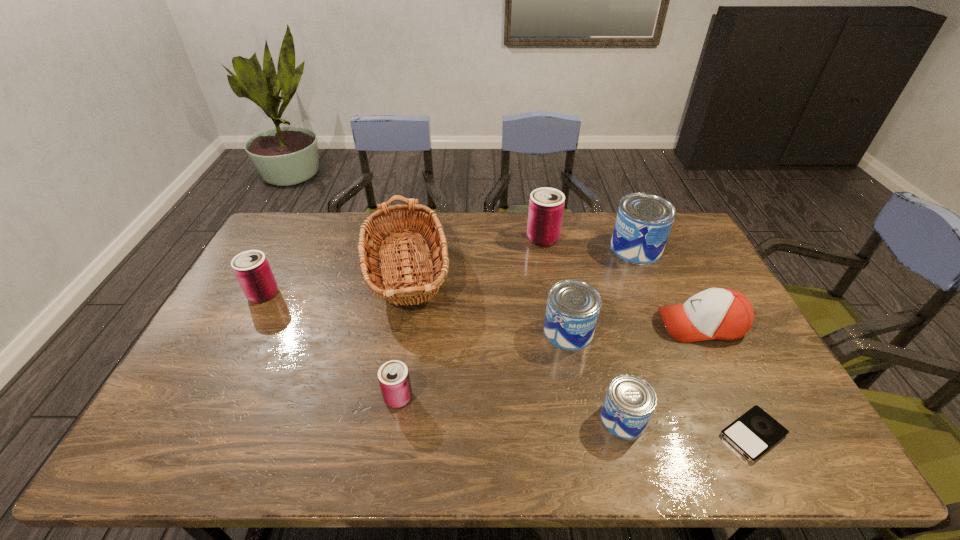
Where is `vacant region between the baseball cap and the second biggest blue can`? vacant region between the baseball cap and the second biggest blue can is located at coordinates (635, 328).

Locate which object ranks eighth in proximity to the basket. Please provide its 2D coordinates. Your answer should be formatted as a tuple, i.e. [(x, y)], where the tuple contains the x and y coordinates of a point satisfying the conditions above.

[(755, 432)]

What are the coordinates of `object that is the second closest to the second nearest blue can` in the screenshot? It's located at (x=723, y=314).

I want to click on can that is the sixth closest to the basket, so click(x=644, y=221).

Locate which can ranks second in proximity to the biggest pink can. Please provide its 2D coordinates. Your answer should be formatted as a tuple, i.e. [(x, y)], where the tuple contains the x and y coordinates of a point satisfying the conditions above.

[(573, 306)]

I want to click on pink can that stands as the third closest to the orange baseball cap, so click(x=251, y=268).

You are a GUI agent. You are given a task and a screenshot of the screen. Output one action in this format:
    pyautogui.click(x=<x>, y=<y>)
    Task: Click on the pink can that is the second closest to the shortest object
    The image size is (960, 540).
    Given the screenshot: What is the action you would take?
    pyautogui.click(x=393, y=376)

Where is `blue can that is the closest to the basket`? The height and width of the screenshot is (540, 960). blue can that is the closest to the basket is located at coordinates (573, 306).

The width and height of the screenshot is (960, 540). Identify the location of blue can that is the closest one to the leftmost can. (573, 306).

Locate an element on the screen. vacant space that satisfies the following two spatial constraints: 1. on the front side of the shortest object; 2. on the left side of the second pink can from left to right is located at coordinates point(393,435).